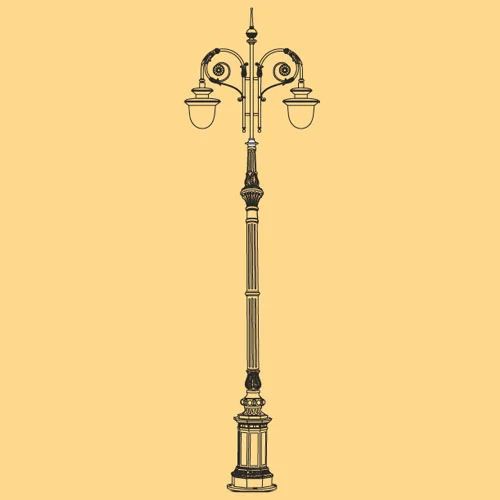
The height and width of the screenshot is (500, 500). I want to click on small rounded silver section toward the top of the lamp, so click(254, 147).